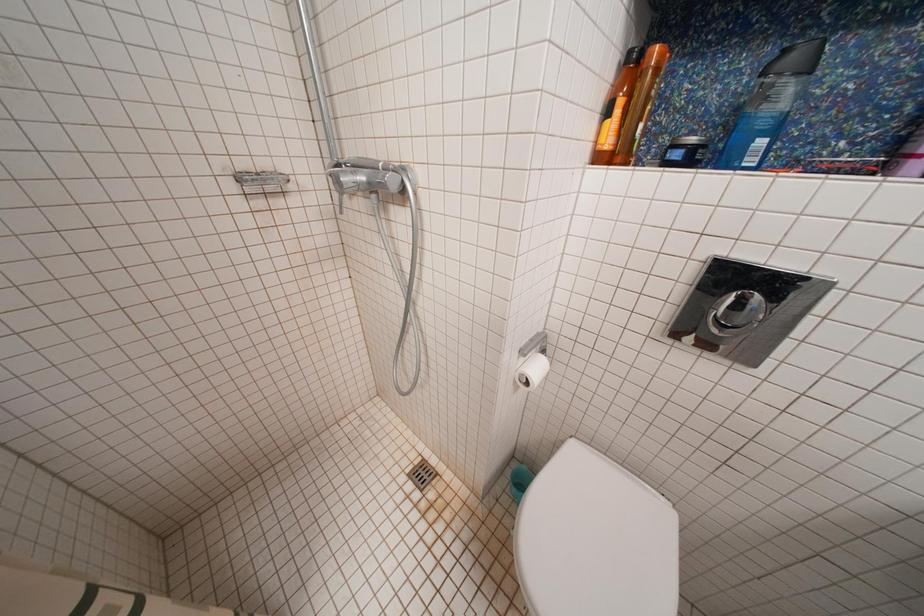
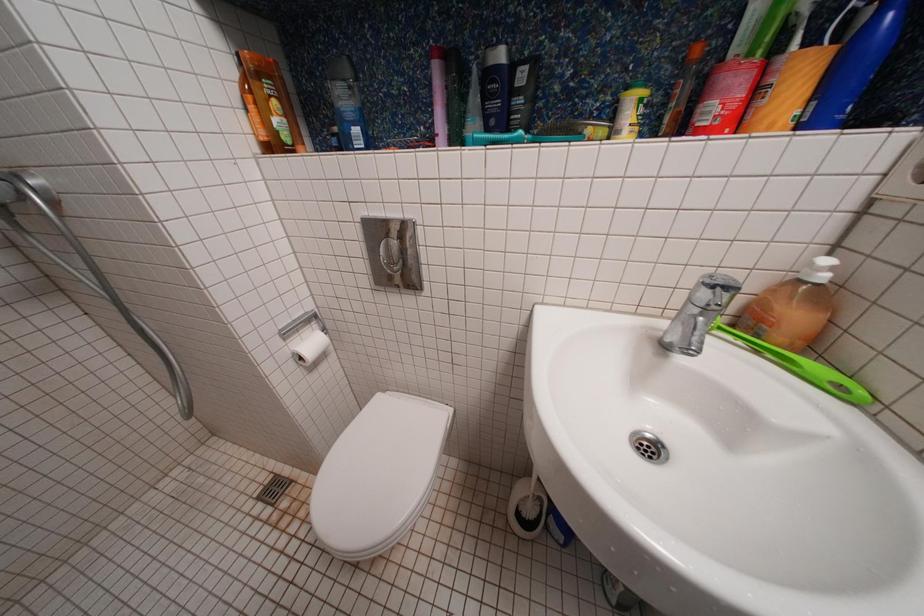
Question: How did the camera likely rotate?

Choices:
 (A) Left
 (B) Right
 (C) Up
 (D) Down

Answer: (B)